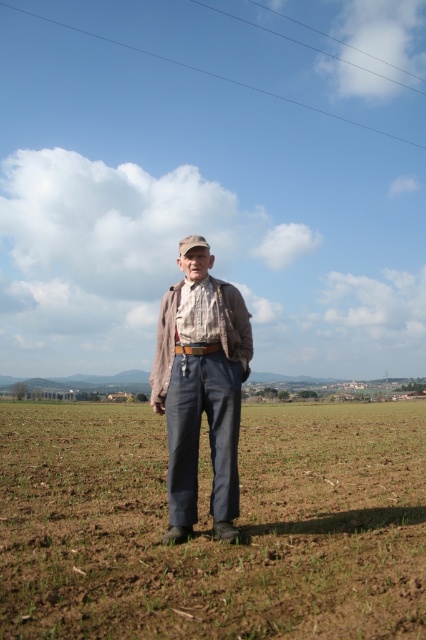
Is dull gray fabric at center closer to camera compared to plaid fabric shirt at center?

Yes, it is in front of plaid fabric shirt at center.

Is point (417, 580) closer to viewer compared to point (206, 333)?

Yes, point (417, 580) is closer to viewer.

Is point (342, 467) positioned in front of point (249, 349)?

No, (342, 467) is behind (249, 349).

I want to click on dull gray fabric at center, so click(210, 524).